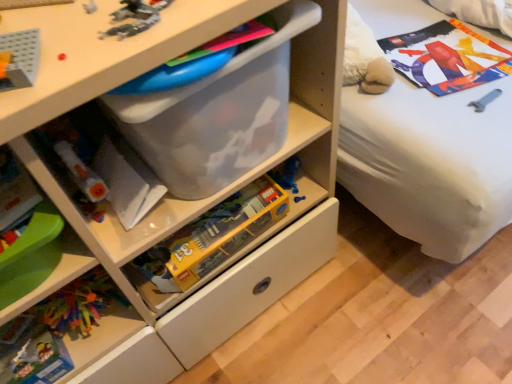
Question: Is translucent plastic toy at upper left, the first toy when ordered from top to bottom, in front of or behind translucent plastic lego box at center, which is the first toy in back-to-front order, in the image?

Choices:
 (A) front
 (B) behind

Answer: (A)

Question: Is translucent plastic toy at upper left, positioned as the first toy in front-to-back order, taller or shorter than translucent plastic lego box at center, marked as the 2th toy in a front-to-back arrangement?

Choices:
 (A) short
 (B) tall

Answer: (A)

Question: Based on their relative distances, which object is farther from the translucent plastic toy at upper left, the first toy when ordered from top to bottom?

Choices:
 (A) translucent plastic lego box at center, which is the first toy in back-to-front order
 (B) transparent plastic chest of drawers at center
 (C) multicolored plastic toys at lower left

Answer: (C)

Question: Which object is the farthest from the translucent plastic lego box at center, the second toy when ordered from top to bottom?

Choices:
 (A) translucent plastic toy at upper left, the first toy when ordered from top to bottom
 (B) multicolored plastic toys at lower left
 (C) transparent plastic chest of drawers at center

Answer: (A)